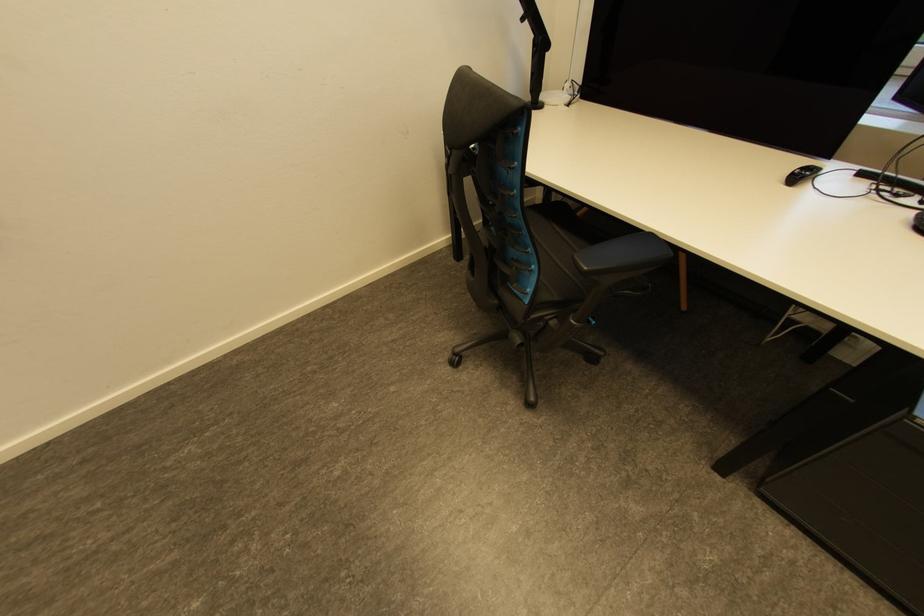
This screenshot has height=616, width=924. Describe the element at coordinates (623, 254) in the screenshot. I see `a black chair armrest` at that location.